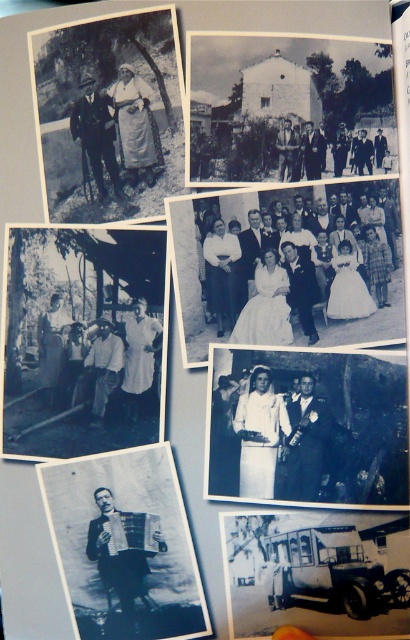
Question: Is white satin dress at center smaller than black fabric accordion at center?

Choices:
 (A) yes
 (B) no

Answer: (B)

Question: Among these objects, which one is nearest to the camera?

Choices:
 (A) white satin dress at center
 (B) black fabric accordion at center

Answer: (A)

Question: Is white satin dress at center thinner than black fabric accordion at center?

Choices:
 (A) yes
 (B) no

Answer: (B)

Question: Which of the following is the closest to the observer?

Choices:
 (A) black fabric accordion at center
 (B) white satin dress at center

Answer: (B)

Question: Is white satin dress at center to the right of black fabric accordion at center from the viewer's perspective?

Choices:
 (A) no
 (B) yes

Answer: (B)